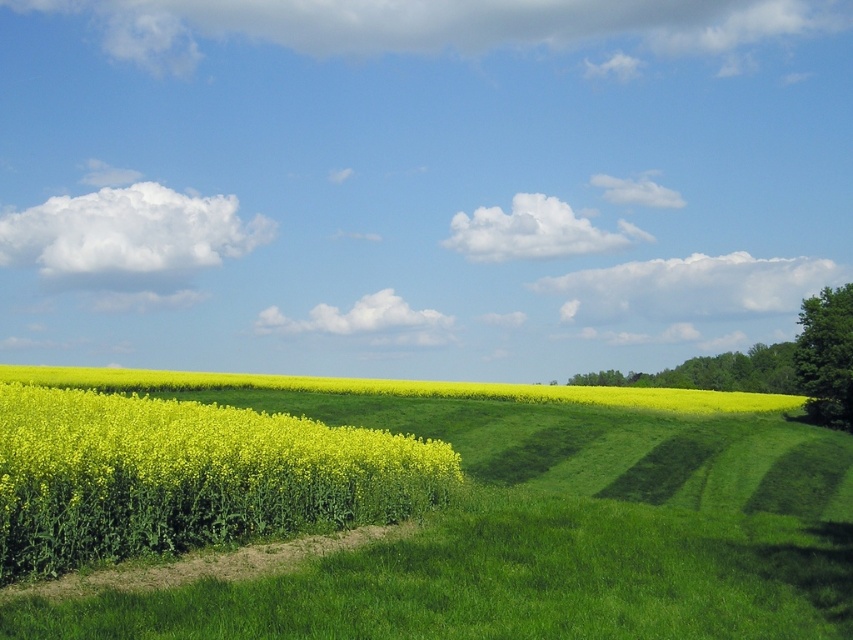
Is green grassy field at center to the left of green leafy tree at right from the viewer's perspective?

Yes, green grassy field at center is to the left of green leafy tree at right.

Which of these two, green grassy field at center or green leafy tree at right, stands shorter?

Standing shorter between the two is green grassy field at center.

Does point (782, 460) lie behind point (833, 381)?

No, (782, 460) is in front of (833, 381).

Where is `green grassy field at center`? green grassy field at center is located at coordinates (544, 532).

Can you confirm if yellow-green grass at left is positioned to the right of green leafy tree at upper right?

In fact, yellow-green grass at left is to the left of green leafy tree at upper right.

How far apart are yellow-green grass at left and green leafy tree at upper right?

A distance of 128.68 meters exists between yellow-green grass at left and green leafy tree at upper right.

Does point (96, 429) come behind point (740, 376)?

No, it is not.

You are a GUI agent. You are given a task and a screenshot of the screen. Output one action in this format:
    pyautogui.click(x=<x>, y=<y>)
    Task: Click on the yellow-green grass at left
    The height and width of the screenshot is (640, 853).
    Given the screenshot: What is the action you would take?
    pyautogui.click(x=189, y=476)

Does point (831, 384) lie behind point (712, 369)?

No, it is not.

Locate an element on the screen. This screenshot has width=853, height=640. green leafy tree at right is located at coordinates (827, 356).

Locate an element on the screen. This screenshot has width=853, height=640. green leafy tree at right is located at coordinates (827, 356).